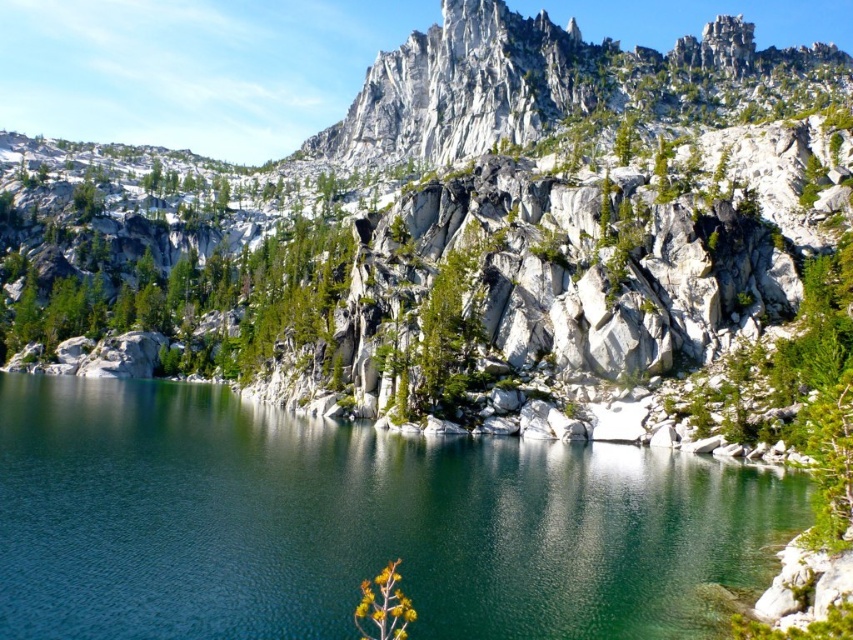
Is white rock mountain at upper center thinner than yellow-green leafy plant at lower center?

No, white rock mountain at upper center is not thinner than yellow-green leafy plant at lower center.

Can you confirm if white rock mountain at upper center is positioned above yellow-green leafy plant at lower center?

Indeed, white rock mountain at upper center is positioned over yellow-green leafy plant at lower center.

Which is behind, point (358, 264) or point (393, 611)?

Point (358, 264)

Identify the location of white rock mountain at upper center. (456, 228).

Does green glossy water at center appear on the left side of yellow-green leafy plant at lower center?

Correct, you'll find green glossy water at center to the left of yellow-green leafy plant at lower center.

Can you confirm if green glossy water at center is thinner than yellow-green leafy plant at lower center?

No.

Where is `green glossy water at center`? green glossy water at center is located at coordinates (352, 524).

You are a GUI agent. You are given a task and a screenshot of the screen. Output one action in this format:
    pyautogui.click(x=<x>, y=<y>)
    Task: Click on the green glossy water at center
    The image size is (853, 640).
    Given the screenshot: What is the action you would take?
    pyautogui.click(x=352, y=524)

Which of these two, white rock mountain at upper center or green glossy water at center, stands taller?

white rock mountain at upper center

Between white rock mountain at upper center and green glossy water at center, which one is positioned higher?

white rock mountain at upper center

Locate an element on the screen. This screenshot has height=640, width=853. white rock mountain at upper center is located at coordinates (456, 228).